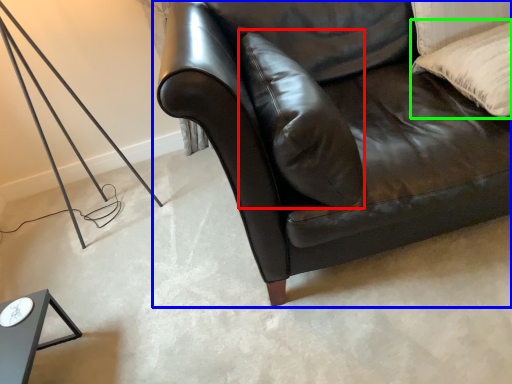
Question: Estimate the real-world distances between objects in this image. Which object is closer to pillow (highlighted by a red box), studio couch (highlighted by a blue box) or pillow (highlighted by a green box)?

Choices:
 (A) studio couch
 (B) pillow

Answer: (A)